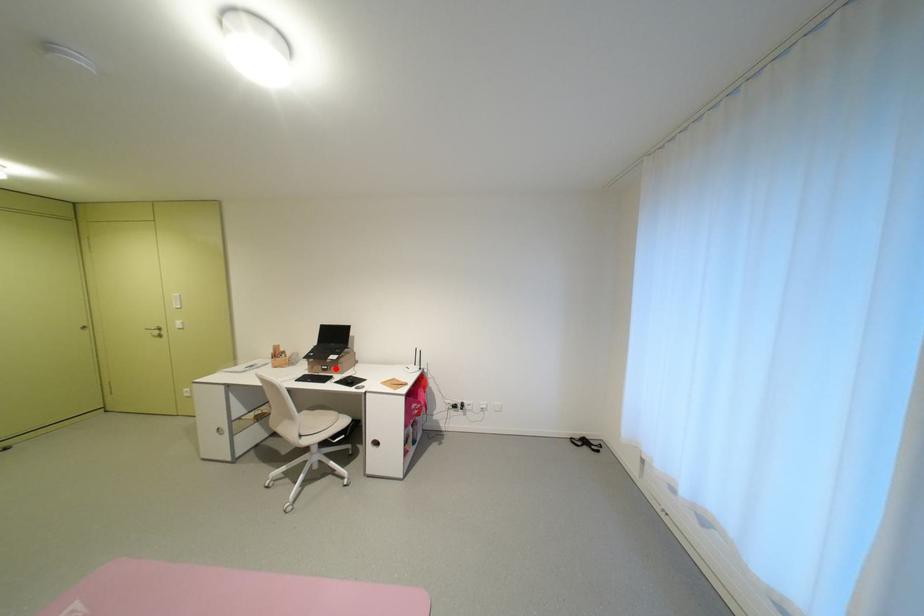
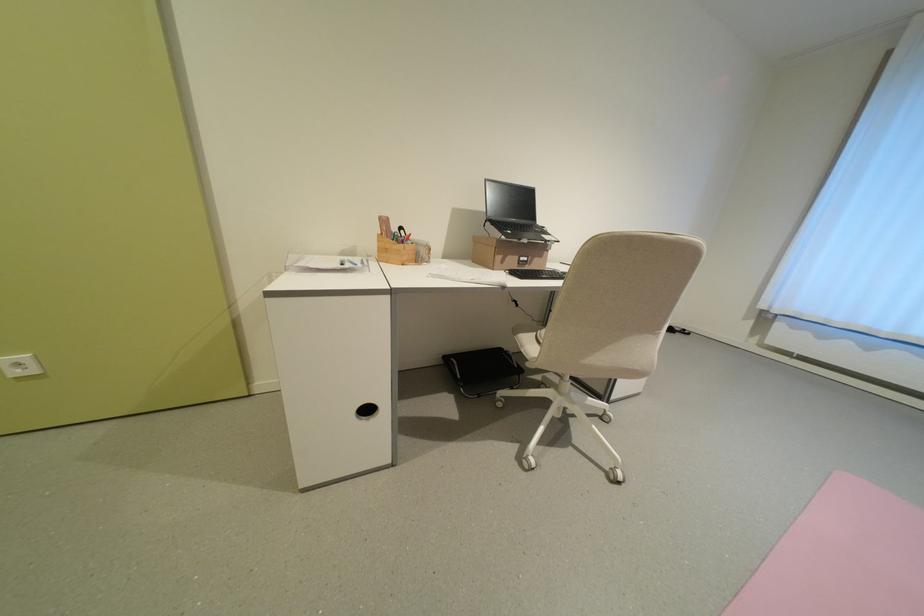
Question: I am providing you with two images of the same scene from different viewpoints. Given a red point in image1, look at the same physical point in image2. Is it:

Choices:
 (A) Closer to the viewpoint
 (B) Farther from the viewpoint

Answer: (A)